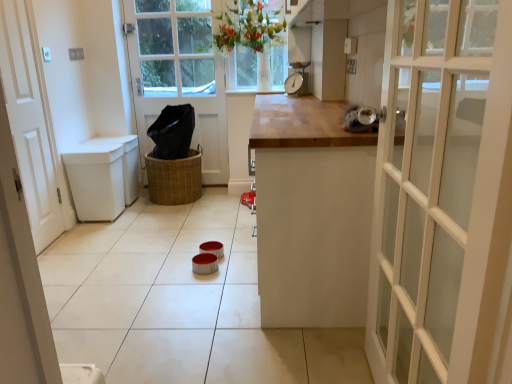
Question: In terms of height, does white matte door at left, the 2th door in the back-to-front sequence, look taller or shorter compared to braided wicker basket at center?

Choices:
 (A) short
 (B) tall

Answer: (B)

Question: Is white matte door at left, the 2th door in the back-to-front sequence, spatially inside braided wicker basket at center, or outside of it?

Choices:
 (A) inside
 (B) outside

Answer: (B)

Question: Which object is the closest to the white wooden door at center, the 1th door from the right?

Choices:
 (A) braided wicker basket at center
 (B) metallic scale at center
 (C) white matte door at left, the second door from the right

Answer: (A)

Question: Which of these objects is positioned closest to the white wooden door at center, the 2th door positioned from the front?

Choices:
 (A) braided wicker basket at center
 (B) white matte door at left, which appears as the first door when viewed from the front
 (C) metallic scale at center

Answer: (A)